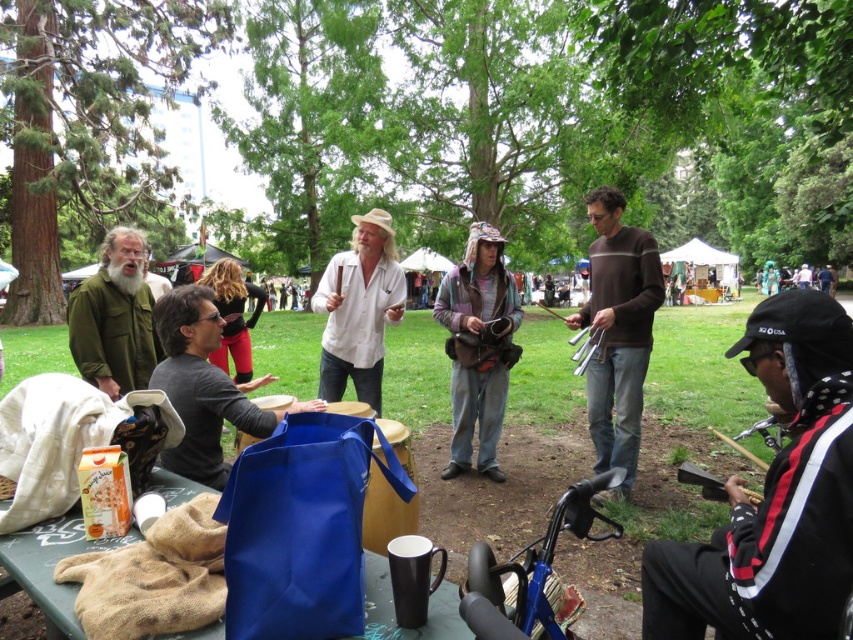
Question: Does black and white jacket at lower right come in front of green matte jacket at left?

Choices:
 (A) yes
 (B) no

Answer: (A)

Question: Can you confirm if brown striped sweater at center is bigger than matte black bag at center?

Choices:
 (A) no
 (B) yes

Answer: (A)

Question: Which of the following is the closest to the observer?

Choices:
 (A) blue fabric bag at lower center
 (B) black and white jacket at lower right
 (C) matte black bag at center

Answer: (B)

Question: Can you confirm if brown striped sweater at center is positioned to the left of blue fabric bag at lower center?

Choices:
 (A) yes
 (B) no

Answer: (B)

Question: Which object appears farthest from the camera in this image?

Choices:
 (A) blue fabric bag at lower center
 (B) brown striped sweater at center
 (C) white cotton shirt at center

Answer: (C)

Question: Estimate the real-world distances between objects in this image. Which object is farther from the matte black bag at center?

Choices:
 (A) brown striped sweater at center
 (B) white cotton shirt at center
 (C) blue fabric bag at lower center
 (D) green matte jacket at left

Answer: (A)